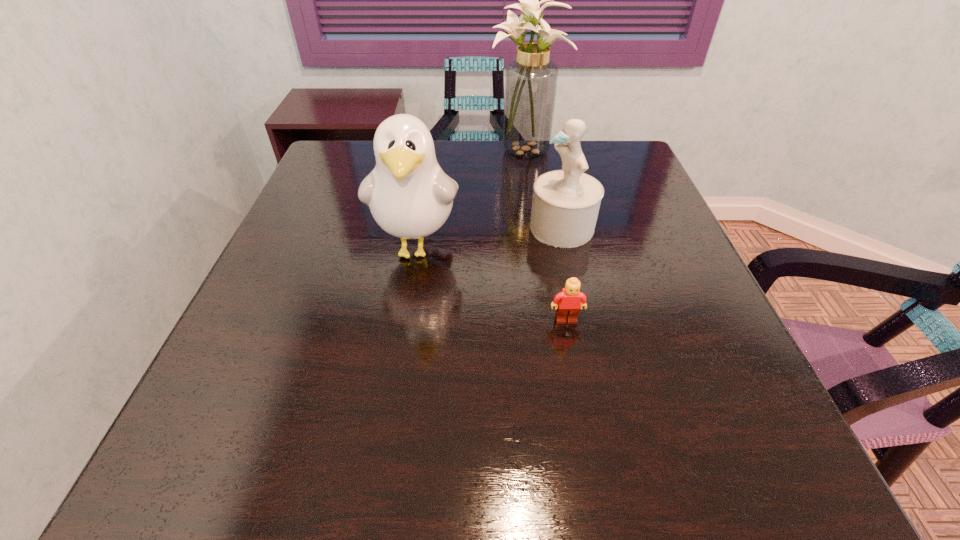
Identify the location of vacant space that's between the figurine and the gull. (490, 238).

This screenshot has width=960, height=540. What are the coordinates of `blank region between the leftmost object and the Lego` in the screenshot? It's located at (492, 284).

At what (x,y) coordinates should I click in order to perform the action: click on vacant area between the nearest object and the figurine. Please return your answer as a coordinate pair (x, y). The image size is (960, 540). Looking at the image, I should click on (564, 274).

Identify which object is the second closest to the leftmost object. Please provide its 2D coordinates. Your answer should be formatted as a tuple, i.e. [(x, y)], where the tuple contains the x and y coordinates of a point satisfying the conditions above.

[(567, 303)]

Identify the location of the second closest object to the shortest object. This screenshot has height=540, width=960. (565, 206).

I want to click on vacant region that satisfies the following two spatial constraints: 1. at the beak of the figurine; 2. on the face of the nearest object, so click(583, 320).

Where is `vacant space that satisfies the following two spatial constraints: 1. at the beak of the figurine; 2. on the face of the Lego`? This screenshot has width=960, height=540. vacant space that satisfies the following two spatial constraints: 1. at the beak of the figurine; 2. on the face of the Lego is located at coordinates (583, 320).

The height and width of the screenshot is (540, 960). Identify the location of free space that satisfies the following two spatial constraints: 1. at the beak of the third tallest object; 2. on the face of the shortest object. point(583,320).